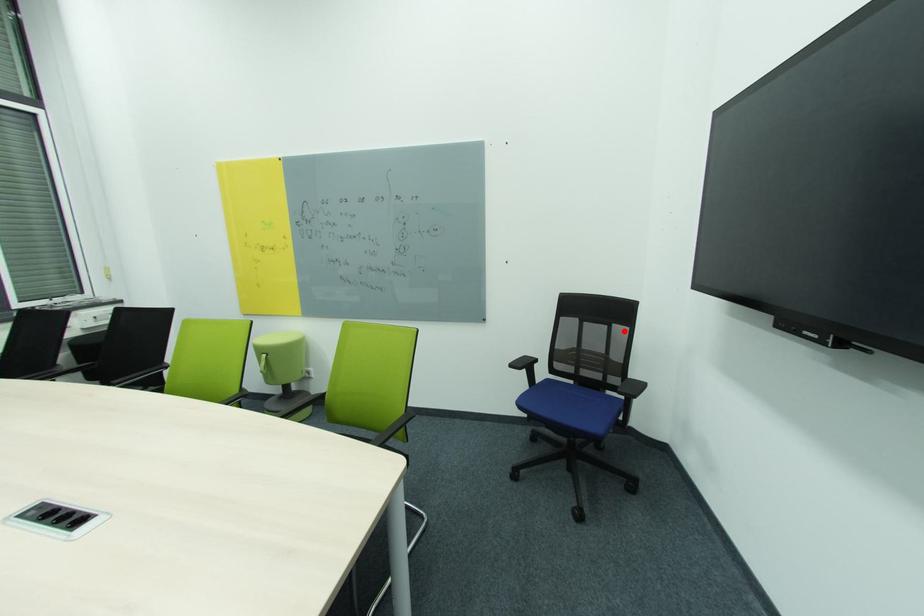
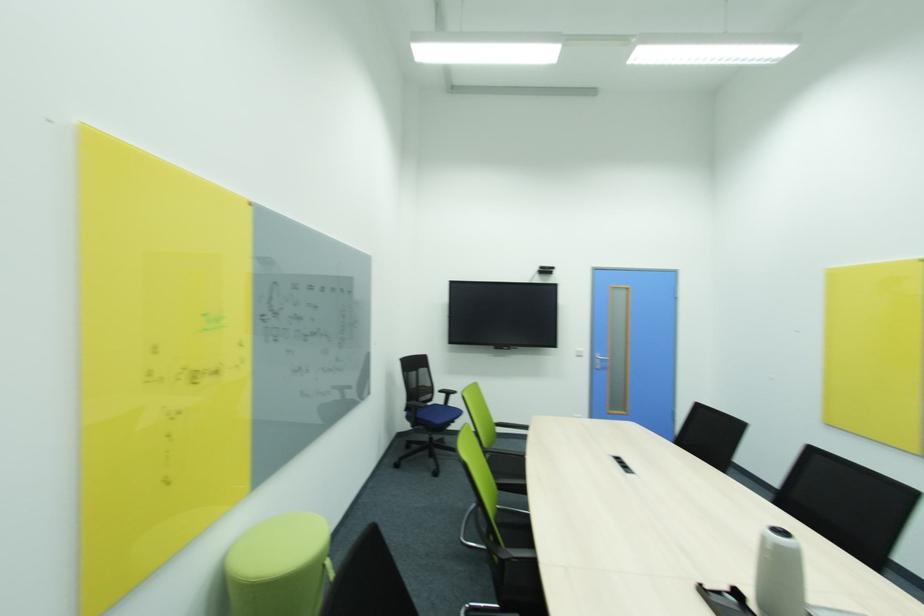
Locate, in the second image, the point that corresponds to the highlighted location in the first image.

(428, 371)